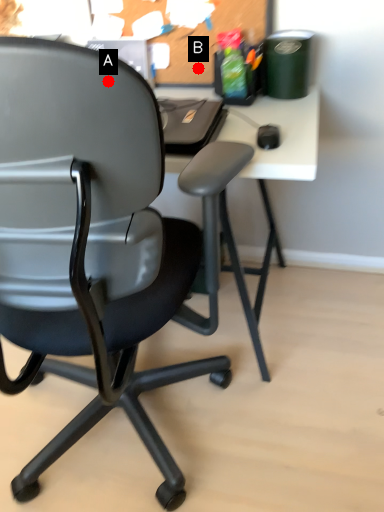
Question: Two points are circled on the image, labeled by A and B beside each circle. Which point is closer to the camera taking this photo?

Choices:
 (A) A is closer
 (B) B is closer

Answer: (A)